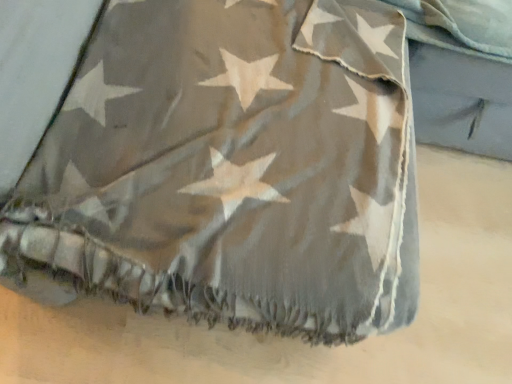
At what (x,y) coordinates should I click in order to perform the action: click on satin fabric dress at center. Please return your answer as a coordinate pair (x, y). Image resolution: width=512 pixels, height=384 pixels. Looking at the image, I should click on (231, 169).

Measure the distance between satin fabric dress at center and camera.

The distance of satin fabric dress at center from camera is 24.36 inches.

Describe the element at coordinates (231, 169) in the screenshot. I see `satin fabric dress at center` at that location.

Find the location of a particular element. satin fabric dress at center is located at coordinates pyautogui.click(x=231, y=169).